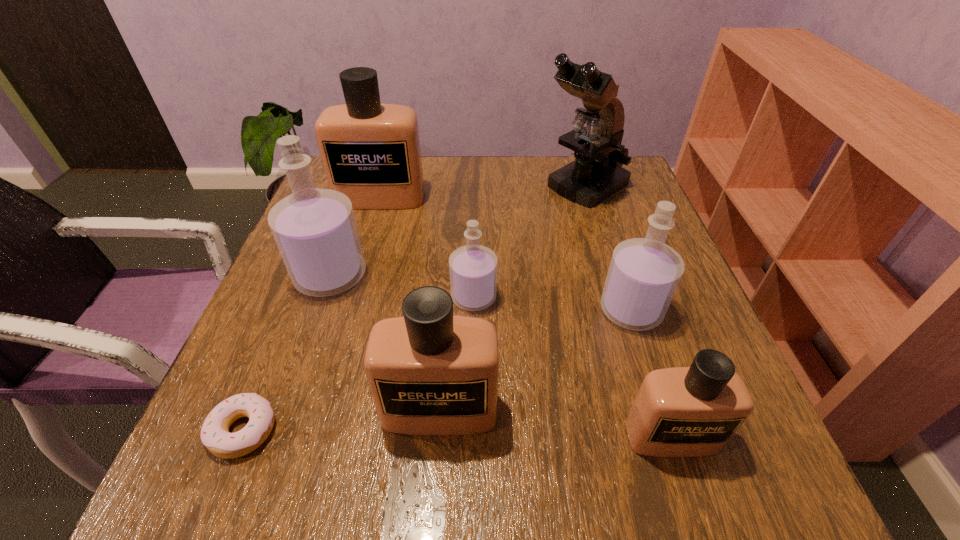
Find the location of a particular element. The height and width of the screenshot is (540, 960). perfume that is at the near edge is located at coordinates (694, 411).

Find the location of a particular element. Image resolution: width=960 pixels, height=540 pixels. doughnut at the near edge is located at coordinates tap(215, 435).

Where is `doughnut present at the left edge`? This screenshot has height=540, width=960. doughnut present at the left edge is located at coordinates (215, 435).

The width and height of the screenshot is (960, 540). I want to click on microscope present at the right edge, so click(597, 173).

Find the location of a particular element. The width and height of the screenshot is (960, 540). object at the far left corner is located at coordinates (370, 151).

The width and height of the screenshot is (960, 540). Find the location of `object that is at the near left corner`. object that is at the near left corner is located at coordinates (215, 435).

Locate an element on the screen. object located in the far right corner section of the desktop is located at coordinates (597, 173).

Find the location of `object that is at the near right corner`. object that is at the near right corner is located at coordinates (694, 411).

The image size is (960, 540). Identify the location of free spot at the far edge of the desktop. (464, 192).

Where is `vacant region at the near edge of the desktop`? The width and height of the screenshot is (960, 540). vacant region at the near edge of the desktop is located at coordinates (492, 501).